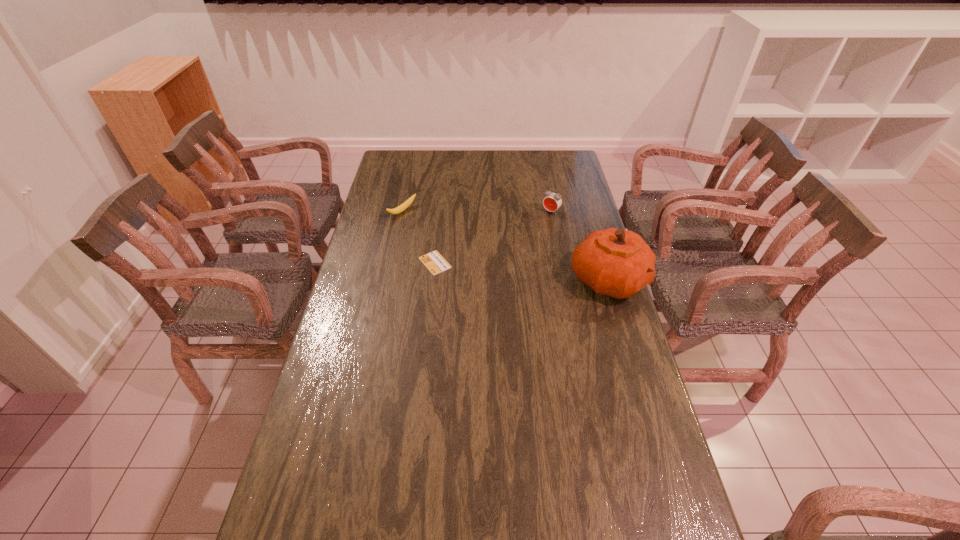
Identify the location of empty location between the tallest object and the banana. The height and width of the screenshot is (540, 960). (505, 246).

This screenshot has width=960, height=540. In order to click on empty location between the banana and the alarm clock in this screenshot , I will do `click(476, 212)`.

Where is `free spot between the pumpkin and the second shortest object`? free spot between the pumpkin and the second shortest object is located at coordinates (505, 246).

Locate an element on the screen. empty space that is in between the second tallest object and the identity card is located at coordinates (493, 237).

The width and height of the screenshot is (960, 540). I want to click on empty location between the tallest object and the banana, so click(x=505, y=246).

Where is `vacant region between the leftmost object and the pumpkin`? The image size is (960, 540). vacant region between the leftmost object and the pumpkin is located at coordinates (505, 246).

The width and height of the screenshot is (960, 540). What are the coordinates of `vacant space that is in between the leftmost object and the second tallest object` in the screenshot? It's located at (476, 212).

Where is `free space between the pumpkin and the third tallest object`? This screenshot has width=960, height=540. free space between the pumpkin and the third tallest object is located at coordinates (505, 246).

The height and width of the screenshot is (540, 960). I want to click on vacant region between the shortest object and the tallest object, so click(x=522, y=271).

The width and height of the screenshot is (960, 540). I want to click on object that ranks as the closest to the shortest object, so click(x=407, y=203).